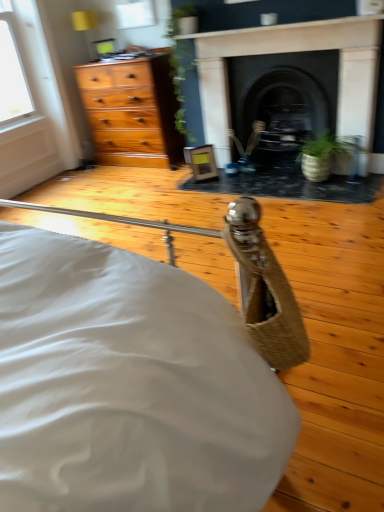
Question: Considering the relative sizes of transparent glass window at upper center and green textured pot at center in the image provided, is transparent glass window at upper center taller than green textured pot at center?

Choices:
 (A) no
 (B) yes

Answer: (A)

Question: Considering the relative positions of transparent glass window at upper center and green textured pot at center in the image provided, is transparent glass window at upper center in front of green textured pot at center?

Choices:
 (A) no
 (B) yes

Answer: (A)

Question: Does transparent glass window at upper center contain green textured pot at center?

Choices:
 (A) no
 (B) yes

Answer: (A)

Question: From a real-world perspective, is transparent glass window at upper center located higher than green textured pot at center?

Choices:
 (A) yes
 (B) no

Answer: (A)

Question: Could you tell me if transparent glass window at upper center is turned towards green textured pot at center?

Choices:
 (A) no
 (B) yes

Answer: (A)

Question: Is transparent glass window at upper center looking in the opposite direction of green textured pot at center?

Choices:
 (A) yes
 (B) no

Answer: (B)

Question: Is black stone fireplace at center, which is the second fireplace in left-to-right order, located within dark stone fireplace at center, marked as the first fireplace in a left-to-right arrangement?

Choices:
 (A) no
 (B) yes

Answer: (A)

Question: From the image's perspective, would you say dark stone fireplace at center, the 2th fireplace positioned from the right, is positioned over black stone fireplace at center, which is the second fireplace in left-to-right order?

Choices:
 (A) no
 (B) yes

Answer: (A)

Question: Can you confirm if dark stone fireplace at center, marked as the first fireplace in a left-to-right arrangement, is positioned to the right of black stone fireplace at center, which appears as the first fireplace when viewed from the right?

Choices:
 (A) yes
 (B) no

Answer: (B)

Question: Can you confirm if dark stone fireplace at center, marked as the first fireplace in a left-to-right arrangement, is smaller than black stone fireplace at center, which appears as the first fireplace when viewed from the right?

Choices:
 (A) no
 (B) yes

Answer: (B)

Question: Can you confirm if dark stone fireplace at center, marked as the first fireplace in a left-to-right arrangement, is bigger than black stone fireplace at center, which is the second fireplace in left-to-right order?

Choices:
 (A) yes
 (B) no

Answer: (B)

Question: Does dark stone fireplace at center, the 2th fireplace positioned from the right, have a greater height compared to black stone fireplace at center, which appears as the first fireplace when viewed from the right?

Choices:
 (A) yes
 (B) no

Answer: (A)

Question: Can you confirm if dark stone fireplace at center, the 2th fireplace positioned from the right, is positioned to the right of transparent glass window at upper center?

Choices:
 (A) no
 (B) yes

Answer: (B)